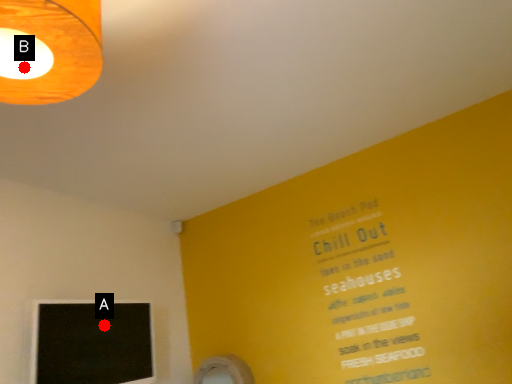
Question: Two points are circled on the image, labeled by A and B beside each circle. Which point is further to the camera?

Choices:
 (A) A is further
 (B) B is further

Answer: (A)